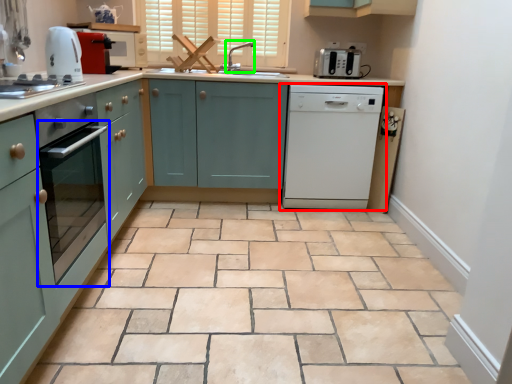
Question: Considering the real-world distances, which object is closest to home appliance (highlighted by a red box)? oven (highlighted by a blue box) or faucet (highlighted by a green box).

Choices:
 (A) oven
 (B) faucet

Answer: (B)